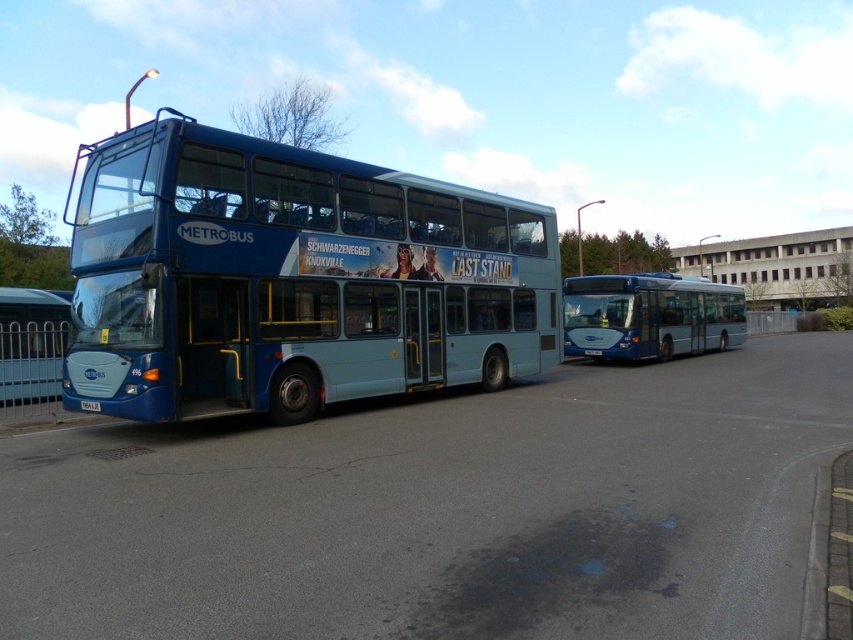
Question: Based on their relative distances, which object is nearer to the white plastic license plate at center?

Choices:
 (A) glossy blue bus at center
 (B) blue metallic bus at center

Answer: (B)

Question: Among these points, which one is farthest from the camera?

Choices:
 (A) (90, 406)
 (B) (195, 173)
 (C) (664, 320)

Answer: (C)

Question: Can you confirm if glossy blue bus at center is bigger than white plastic license plate at center?

Choices:
 (A) yes
 (B) no

Answer: (A)

Question: Which is nearer to the glossy blue bus at center?

Choices:
 (A) blue metallic bus at center
 (B) white plastic license plate at center

Answer: (A)

Question: Is blue metallic bus at center bigger than glossy blue bus at center?

Choices:
 (A) no
 (B) yes

Answer: (B)

Question: Does blue metallic bus at center have a lesser width compared to glossy blue bus at center?

Choices:
 (A) no
 (B) yes

Answer: (A)